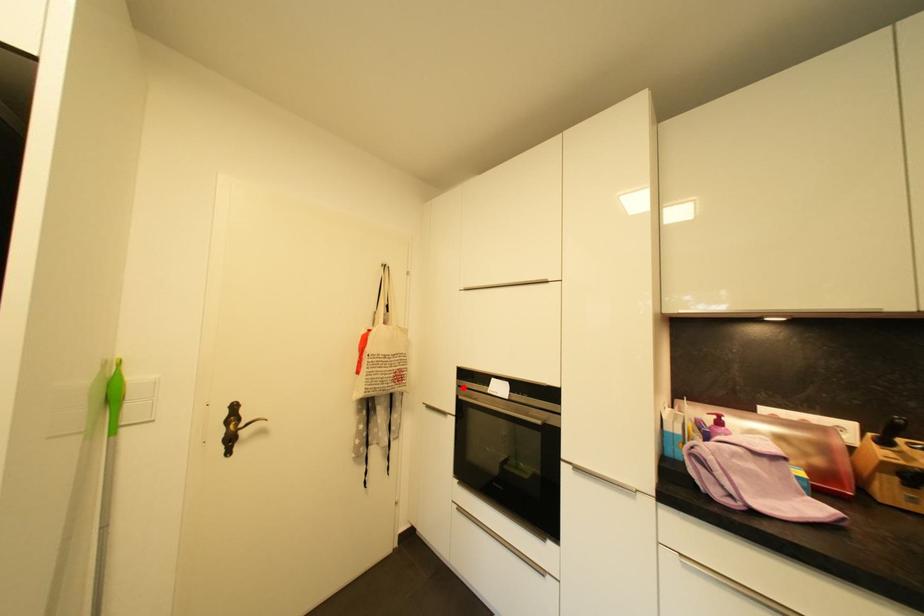
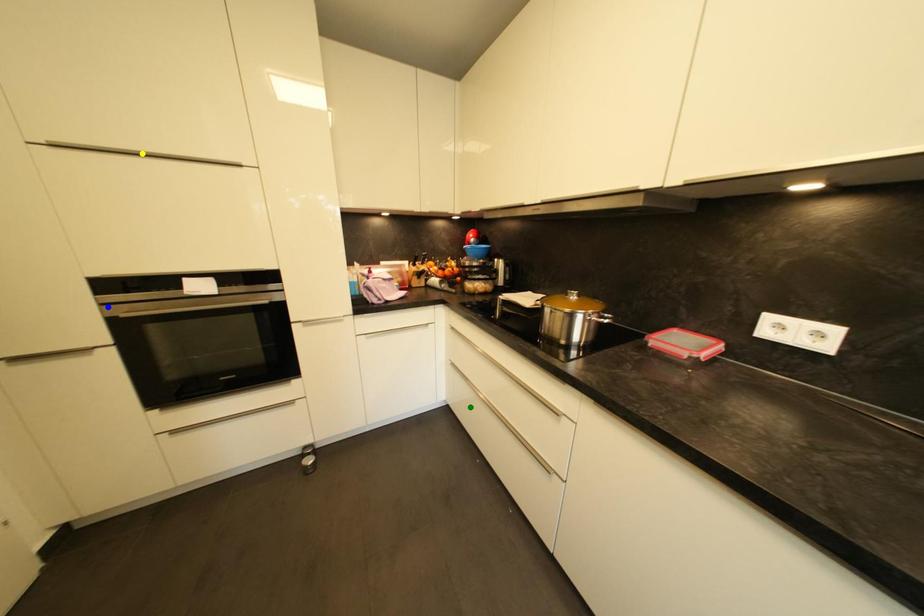
Question: I am providing you with two images of the same scene from different viewpoints. A red point is marked on the first image. You are given multiple points on the second image. Which point in image 2 is actually the same real-world point as the red point in image 1?

Choices:
 (A) blue point
 (B) yellow point
 (C) green point

Answer: (A)